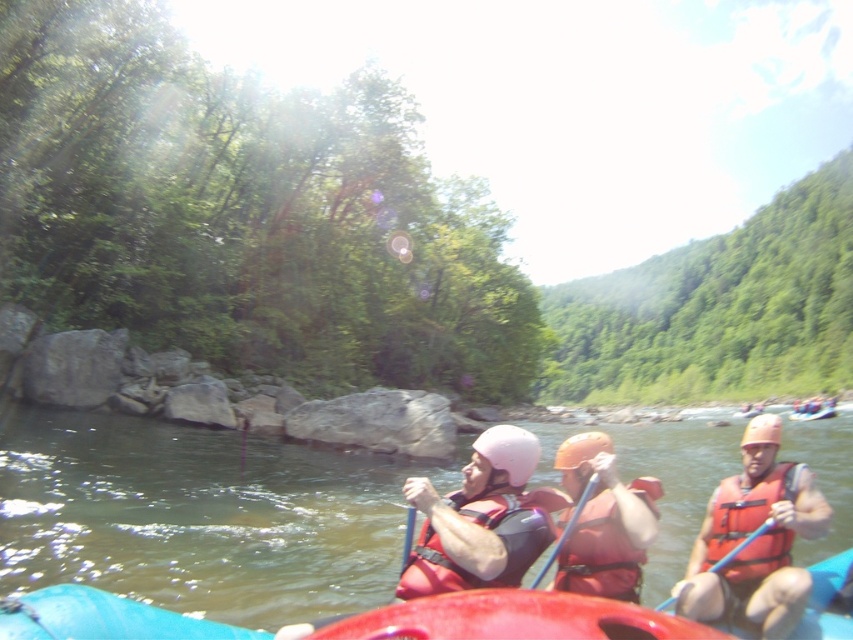
Is orange life jacket at center thinner than blue plastic paddle at center?

No.

Does orange life jacket at center have a lesser height compared to blue plastic paddle at center?

No.

This screenshot has height=640, width=853. I want to click on orange life jacket at center, so click(x=741, y=509).

Does red life jacket at center come behind red matte life jacket at center?

That is False.

Can you confirm if red life jacket at center is thinner than red matte life jacket at center?

In fact, red life jacket at center might be wider than red matte life jacket at center.

Locate an element on the screen. This screenshot has width=853, height=640. red life jacket at center is located at coordinates (483, 528).

Locate an element on the screen. This screenshot has height=640, width=853. red life jacket at center is located at coordinates tap(483, 528).

Does orange life vest at right have a lesser height compared to red matte life jacket at center?

No.

Is orange life vest at right below red matte life jacket at center?

Indeed, orange life vest at right is positioned under red matte life jacket at center.

Which is in front, point (804, 570) or point (599, 584)?

Point (599, 584) is in front.

Identify the location of orange life vest at right. The height and width of the screenshot is (640, 853). (755, 540).